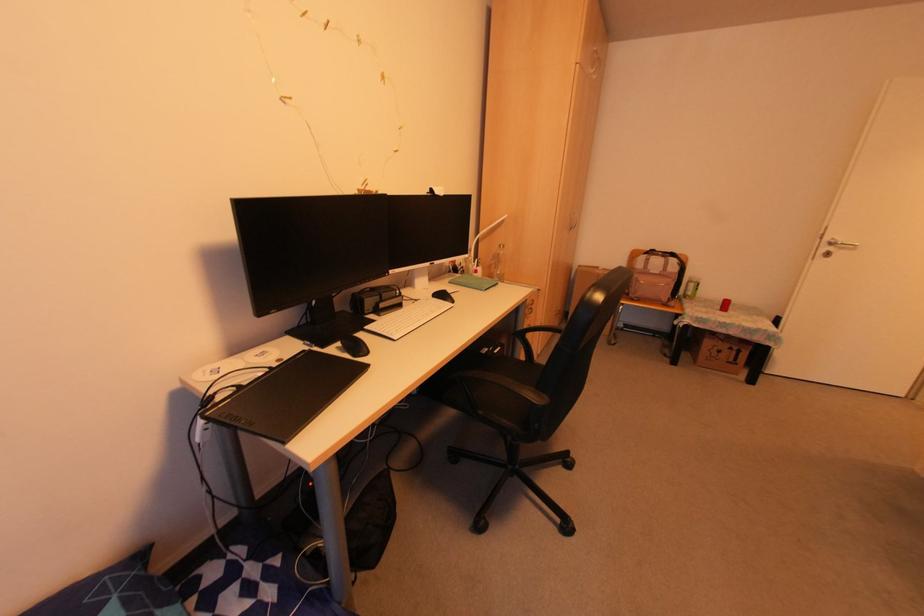
This screenshot has width=924, height=616. I want to click on green spray can, so click(x=690, y=288).